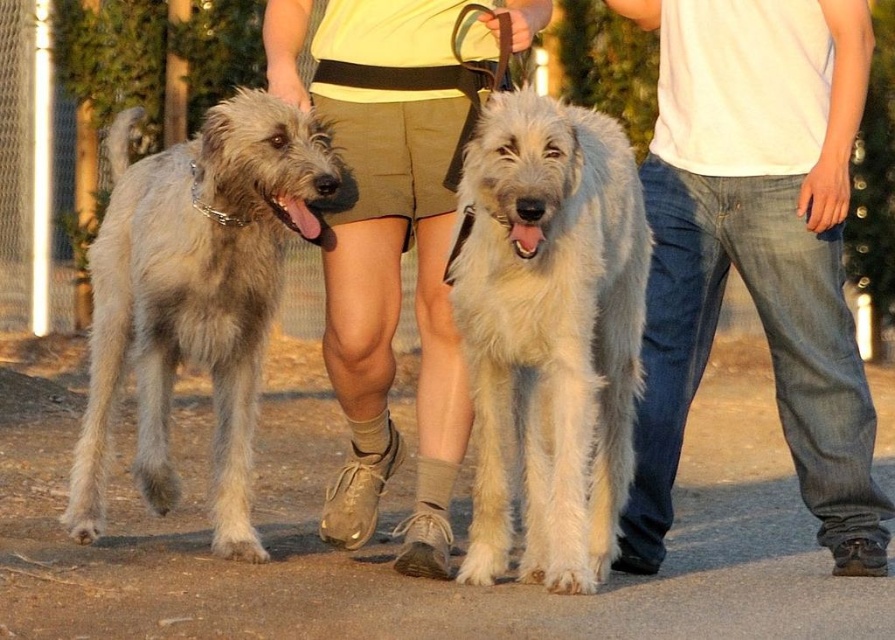
Locate an element on the screen. The height and width of the screenshot is (640, 895). light beige shorts at center is located at coordinates (385, 246).

What do you see at coordinates (385, 246) in the screenshot?
I see `light beige shorts at center` at bounding box center [385, 246].

Identify the location of light beige shorts at center. (385, 246).

In order to click on light beige shorts at center in this screenshot , I will do `click(385, 246)`.

Locate an element on the screen. This screenshot has width=895, height=640. denim jeans at right is located at coordinates (756, 250).

Between point (868, 512) and point (371, 257), which one is positioned in front?

Point (371, 257)

This screenshot has width=895, height=640. In order to click on denim jeans at right in this screenshot , I will do `click(756, 250)`.

Is silvery fur dog at center bigger than light beige shorts at center?

Incorrect, silvery fur dog at center is not larger than light beige shorts at center.

Find the location of a particular element. silvery fur dog at center is located at coordinates (757, 248).

Locate an element on the screen. The image size is (895, 640). silvery fur dog at center is located at coordinates [x=757, y=248].